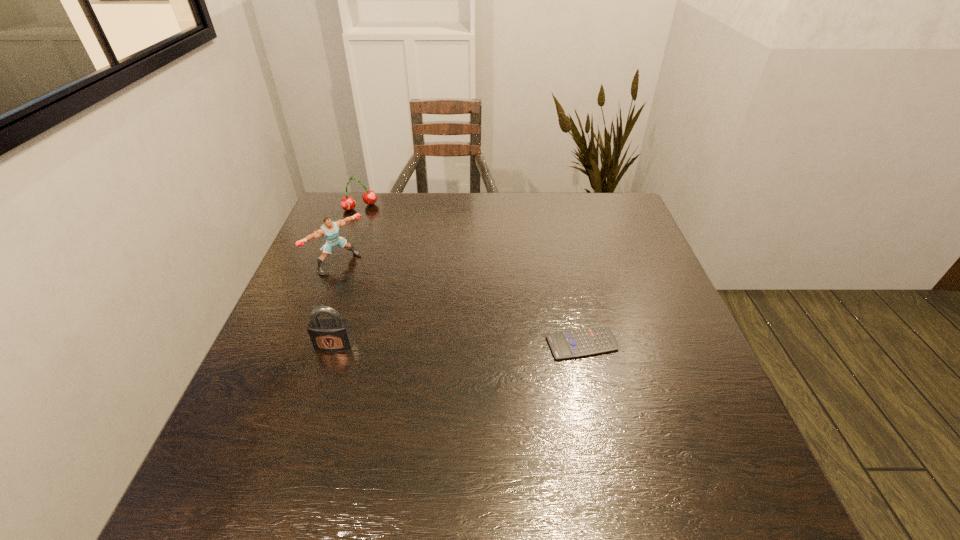
You are a GUI agent. You are given a task and a screenshot of the screen. Output one action in this format:
    pyautogui.click(x=<x>, y=<y>)
    Task: Click on the padlock
    The height and width of the screenshot is (540, 960).
    Given the screenshot: What is the action you would take?
    pyautogui.click(x=334, y=333)

Where is `the rightmost object`? This screenshot has height=540, width=960. the rightmost object is located at coordinates (579, 342).

The height and width of the screenshot is (540, 960). I want to click on calculator, so click(x=579, y=342).

This screenshot has height=540, width=960. I want to click on the farthest object, so click(348, 203).

Find the location of a particular element. The height and width of the screenshot is (540, 960). the tallest object is located at coordinates (329, 230).

You are a GUI agent. You are given a task and a screenshot of the screen. Output one action in this format:
    pyautogui.click(x=<x>, y=<y>)
    Task: Click on the puncher
    The width and height of the screenshot is (960, 540).
    Given the screenshot: What is the action you would take?
    pyautogui.click(x=329, y=230)

Identify the location of free spot located on the front of the padlock near the keyhole. This screenshot has height=540, width=960. (302, 442).

Image resolution: width=960 pixels, height=540 pixels. Identify the location of blank area located on the left of the calculator. (502, 343).

Where is `free point located 0.200m with stems pointing upwards on the cherry`? free point located 0.200m with stems pointing upwards on the cherry is located at coordinates point(386,247).

I want to click on free space located with stems pointing upwards on the cherry, so click(411, 289).